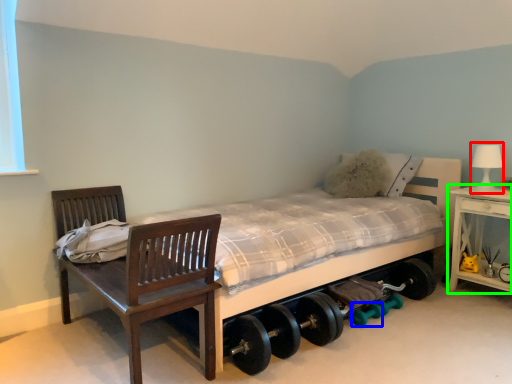
Question: Which object is the closest to the table lamp (highlighted by a red box)? Choose among these: dumbbell (highlighted by a blue box) or nightstand (highlighted by a green box).

Choices:
 (A) dumbbell
 (B) nightstand

Answer: (B)